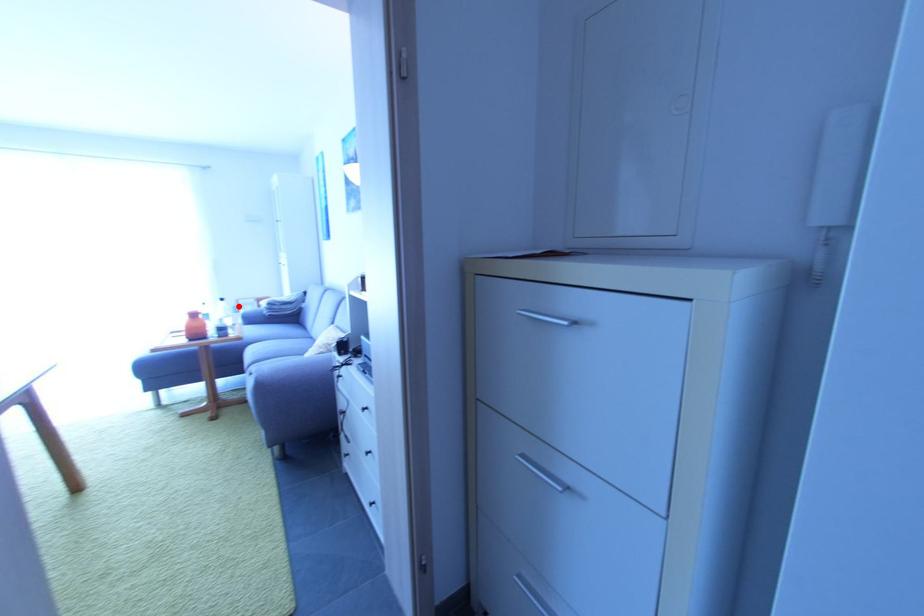
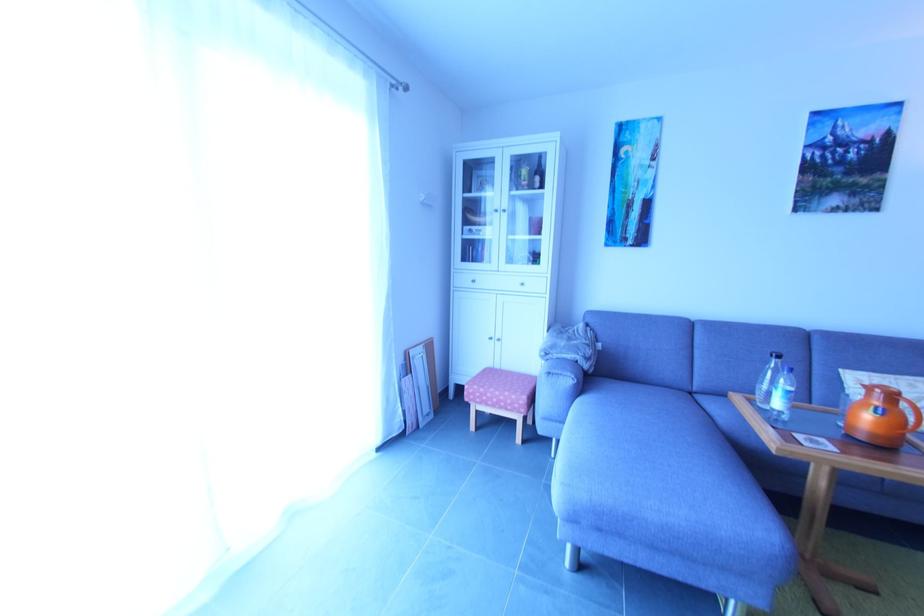
Question: I am providing you with two images of the same scene from different viewpoints. Image1 has a red point marked. In image2, the corresponding 3D location appears at what relative position? Reply with the corresponding letter.

Choices:
 (A) Closer
 (B) Farther

Answer: (A)